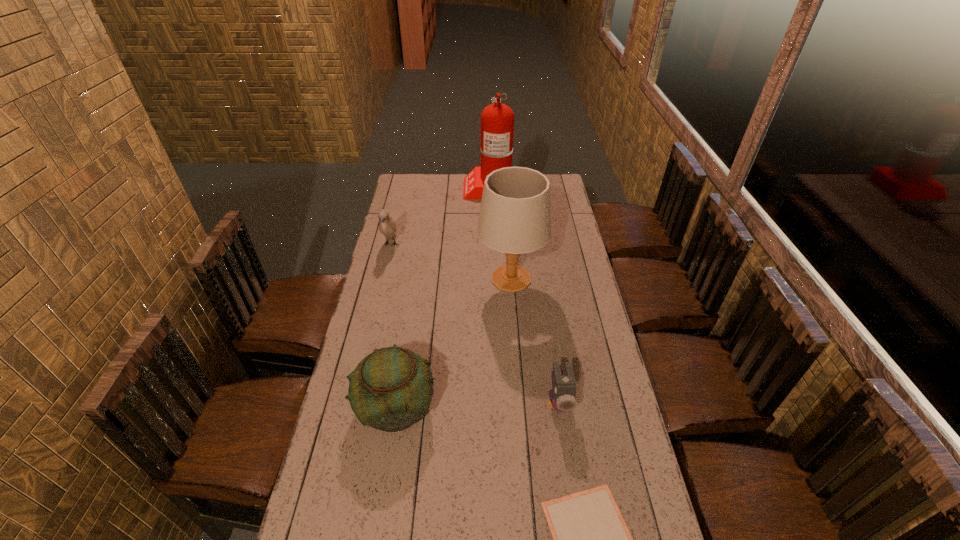
At what (x,y) coordinates should I click in order to perform the action: click on fire extinguisher. Please return your answer as a coordinate pair (x, y). Looking at the image, I should click on (497, 120).

The width and height of the screenshot is (960, 540). Identify the location of the fifth shortest object. (515, 215).

Locate an element on the screen. The width and height of the screenshot is (960, 540). the left bird is located at coordinates (387, 226).

Locate an element on the screen. the taller bird is located at coordinates (387, 226).

Where is `pottery`? pottery is located at coordinates (391, 388).

I want to click on the right bird, so point(563,395).

At what (x,y) coordinates should I click in order to perform the action: click on the nearer bird. Please return your answer as a coordinate pair (x, y). The height and width of the screenshot is (540, 960). Looking at the image, I should click on (563, 395).

This screenshot has height=540, width=960. Identify the location of vacant region located 0.170m on the front-facing side of the farthest object. (432, 187).

Where is `free spot located 0.200m on the front-facing side of the farthest object`? free spot located 0.200m on the front-facing side of the farthest object is located at coordinates (427, 187).

Locate an element on the screen. The height and width of the screenshot is (540, 960). vacant space positioned 0.310m on the front-facing side of the farthest object is located at coordinates (407, 187).